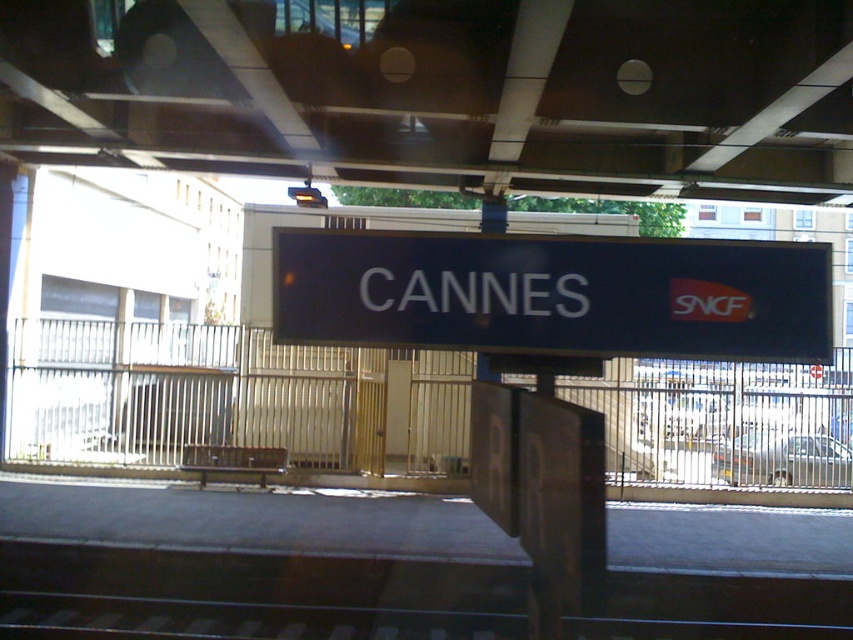
You are a station maintenance worker who needs to place a new sign that is 1.2 meters wide. The existing black matte sign at center is currently occupying space. Can the metal at center accommodate the new sign without overlapping?

The metal at center has a width larger than the black matte sign at center. Since the existing sign is smaller than the metal structure, there should be enough space to place the new 1.2 meter wide sign on the metal at center without overlapping, provided the metal is wide enough to fit the new size.